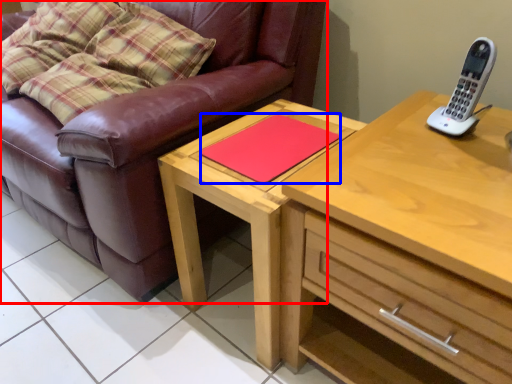
Question: Which of the following is the farthest to the observer, studio couch (highlighted by a red box) or pad (highlighted by a blue box)?

Choices:
 (A) studio couch
 (B) pad

Answer: (B)